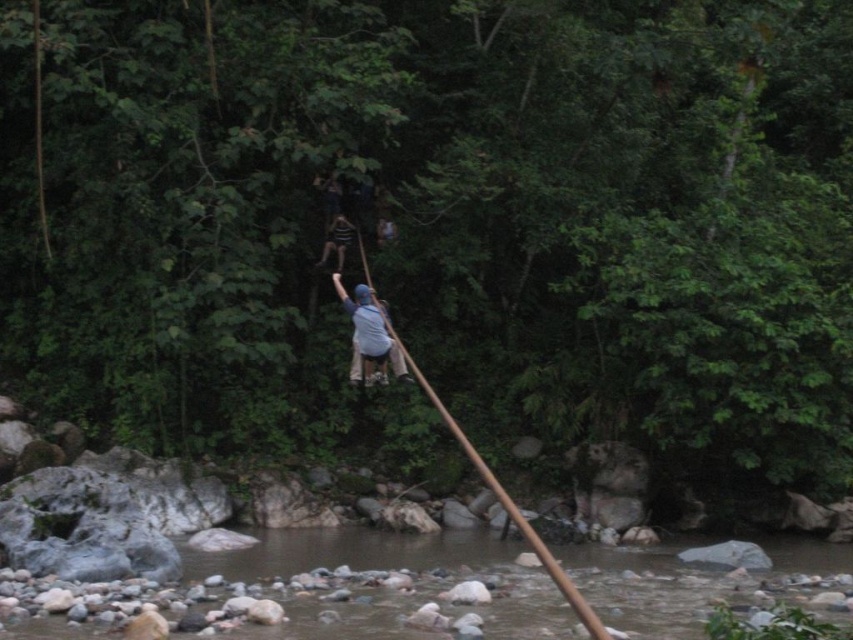
Can you confirm if brown rocky water at lower center is taller than light blue fabric at center?

Yes.

Where is `brown rocky water at lower center`? This screenshot has width=853, height=640. brown rocky water at lower center is located at coordinates (311, 593).

Who is more forward, (376, 317) or (352, 228)?

Point (376, 317) is in front.

Locate an element on the screen. light blue fabric at center is located at coordinates (368, 333).

At what (x,y) coordinates should I click in order to perform the action: click on light blue fabric at center. Please return your answer as a coordinate pair (x, y). The height and width of the screenshot is (640, 853). Looking at the image, I should click on (368, 333).

From the picture: Between brown rocky water at lower center and striped fabric shirt at center, which one is positioned higher?

Positioned higher is striped fabric shirt at center.

Can you confirm if brown rocky water at lower center is smaller than striped fabric shirt at center?

Incorrect, brown rocky water at lower center is not smaller in size than striped fabric shirt at center.

Which is behind, point (305, 620) or point (329, 232)?

The point (329, 232) is behind.

Locate an element on the screen. brown rocky water at lower center is located at coordinates (311, 593).